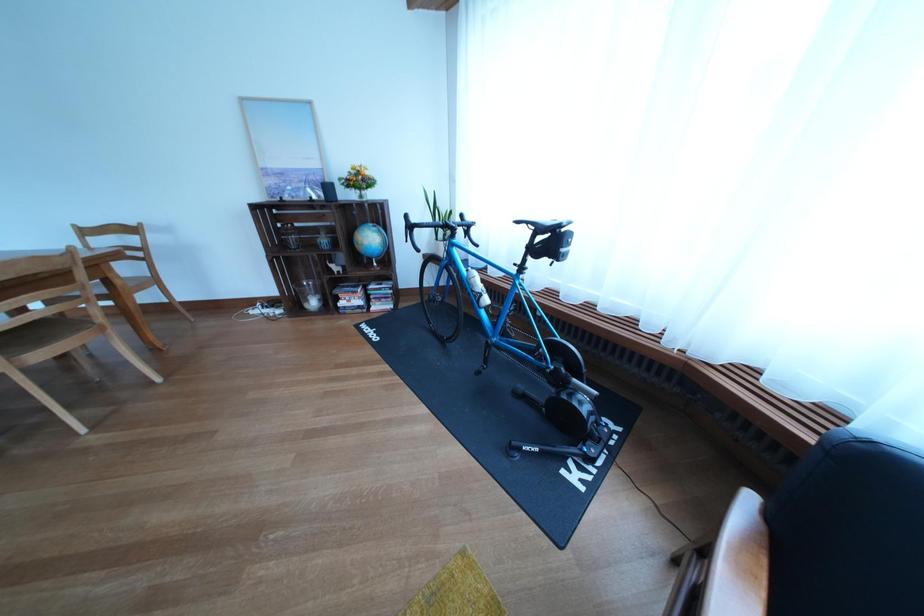
The height and width of the screenshot is (616, 924). What are the coordinates of `clear glass vase` in the screenshot? It's located at (309, 294).